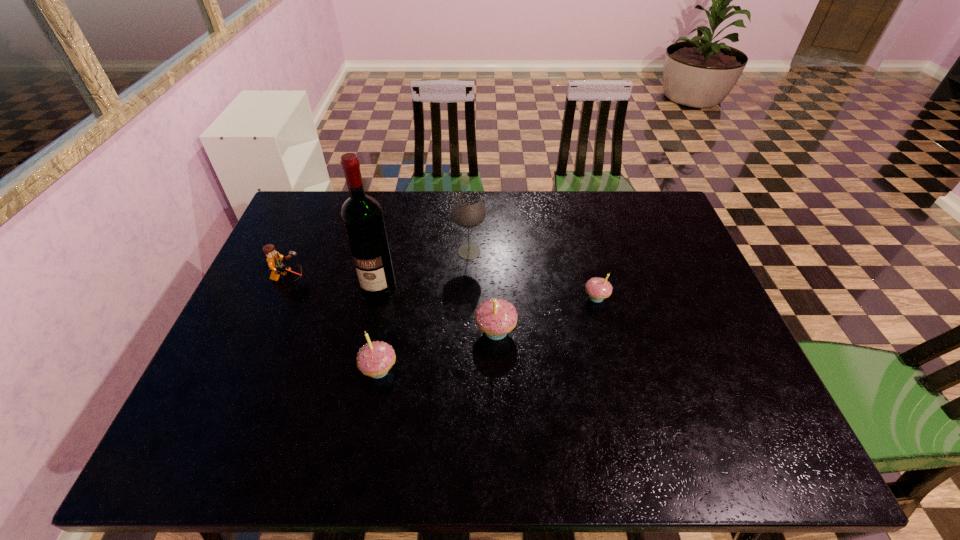
The height and width of the screenshot is (540, 960). In order to click on free space between the tallest cupcake and the Lego in this screenshot , I will do `click(393, 305)`.

The image size is (960, 540). I want to click on free space between the second farthest cupcake and the alcohol, so click(437, 309).

You are a GUI agent. You are given a task and a screenshot of the screen. Output one action in this format:
    pyautogui.click(x=<x>, y=<y>)
    Task: Click on the free spot between the nearest cupcake and the tallest object
    
    Given the screenshot: What is the action you would take?
    pyautogui.click(x=378, y=328)

Find the location of a particular element. free space between the leftmost object and the second nearest object is located at coordinates (393, 305).

Select which object is the closest to the tallest object. Please provide its 2D coordinates. Your answer should be formatted as a tuple, i.e. [(x, y)], where the tuple contains the x and y coordinates of a point satisfying the conditions above.

[(274, 259)]

This screenshot has width=960, height=540. Identify the location of object that can be found as the closest to the second shortest cupcake. (362, 218).

Find the location of a particular element. This screenshot has height=540, width=960. the third closest cupcake to the second tallest object is located at coordinates (375, 359).

Locate an element on the screen. cupcake identified as the third closest to the farthest object is located at coordinates (375, 359).

Locate an element on the screen. The width and height of the screenshot is (960, 540). vacant region that satisfies the following two spatial constraints: 1. holding a crossbow in the hands of the leftmost object; 2. on the left side of the tallest cupcake is located at coordinates (267, 331).

Find the location of a particular element. The height and width of the screenshot is (540, 960). vacant area that satisfies the following two spatial constraints: 1. on the front side of the fifth shortest object; 2. holding a crossbow in the hands of the leftmost object is located at coordinates (468, 279).